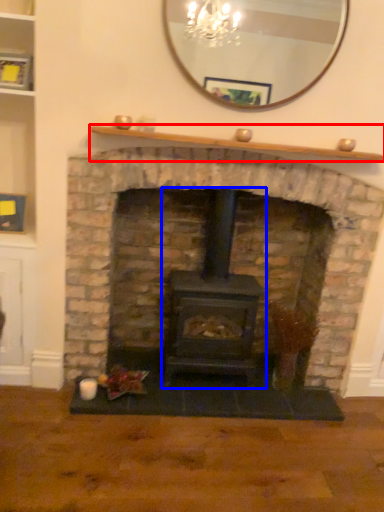
Question: Which object appears farthest to the camera in this image, mantle (highlighted by a red box) or wood burning stove (highlighted by a blue box)?

Choices:
 (A) mantle
 (B) wood burning stove

Answer: (B)